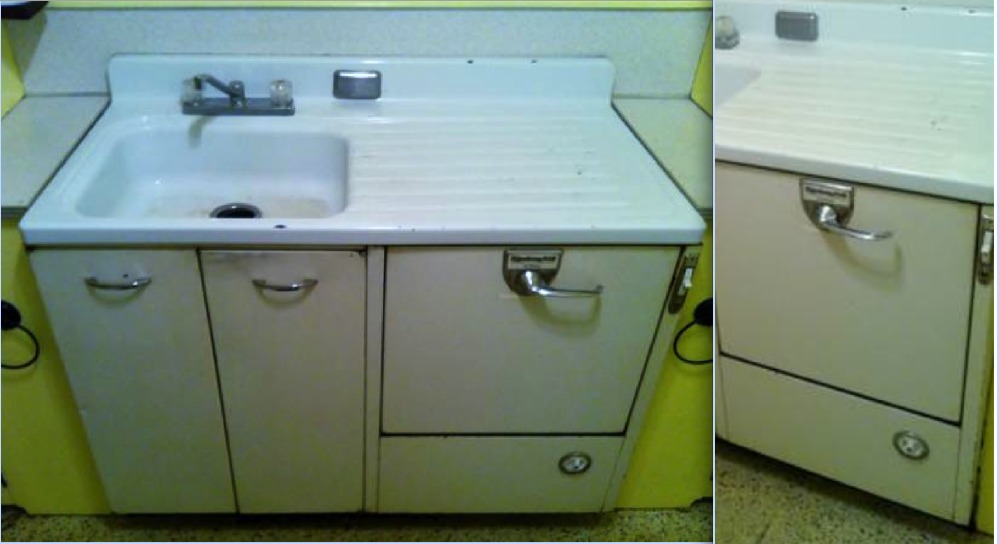
The width and height of the screenshot is (999, 544). Find the location of `floor`. floor is located at coordinates (769, 506).